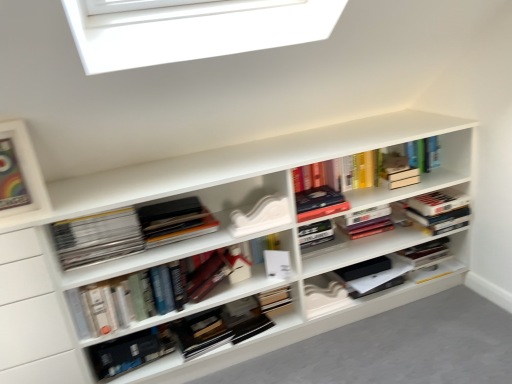
This screenshot has width=512, height=384. Identify the location of empty space that is ontop of hardcover books at center, arranged as the fourth book when viewed from the right. (119, 261).